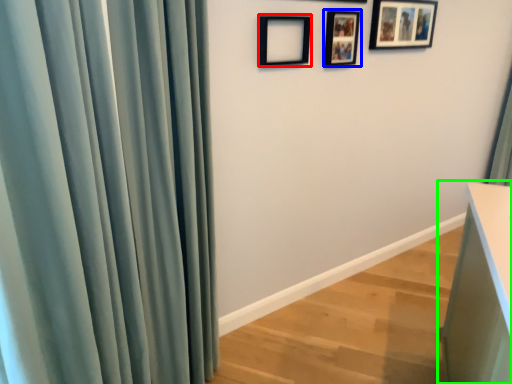
Question: Based on their relative distances, which object is farther from picture frame (highlighted by a red box)? Choose from picture frame (highlighted by a blue box) and vanity (highlighted by a green box).

Choices:
 (A) picture frame
 (B) vanity

Answer: (B)